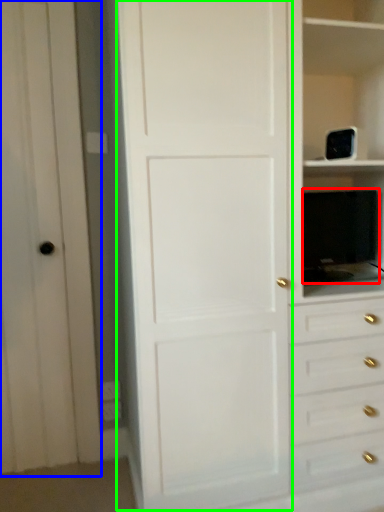
Question: Which is nearer to the appliance (highlighted by a red box)? glass door (highlighted by a blue box) or door (highlighted by a green box).

Choices:
 (A) glass door
 (B) door

Answer: (B)